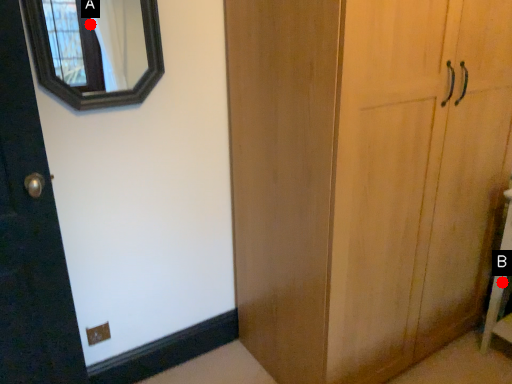
Question: Two points are circled on the image, labeled by A and B beside each circle. Which point is closer to the camera?

Choices:
 (A) A is closer
 (B) B is closer

Answer: (B)